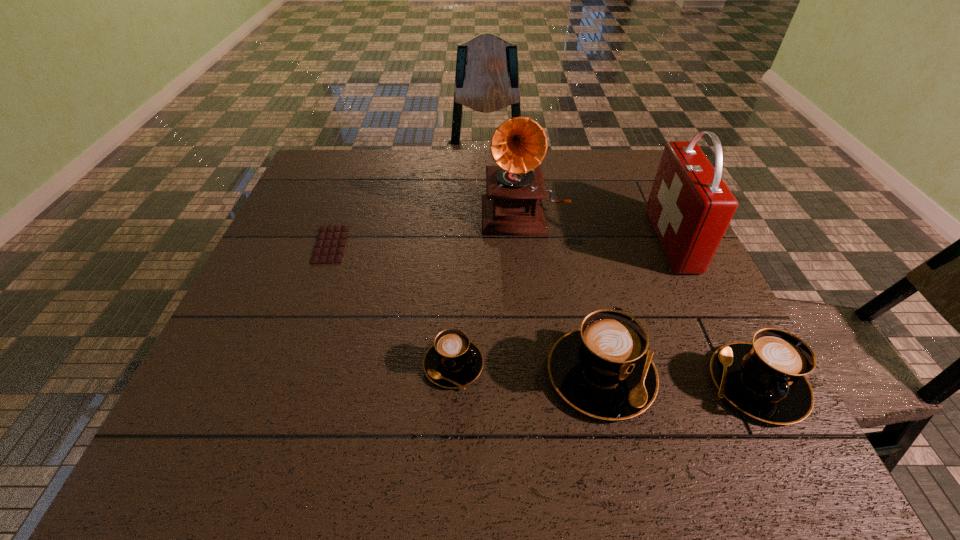
Image resolution: width=960 pixels, height=540 pixels. Find the location of `vacant area situated on the back of the second cappuccino from right to left`. vacant area situated on the back of the second cappuccino from right to left is located at coordinates (588, 310).

Find the location of a particular element. free space located 0.260m on the back of the fourth tallest object is located at coordinates (693, 259).

The height and width of the screenshot is (540, 960). Find the location of `free region located on the horn of the phonograph record`. free region located on the horn of the phonograph record is located at coordinates (540, 347).

This screenshot has width=960, height=540. Find the location of `vacant space located on the front face of the first-aid kit`. vacant space located on the front face of the first-aid kit is located at coordinates (546, 241).

Locate an element on the screen. vacant region located 0.080m on the front face of the first-aid kit is located at coordinates (625, 241).

Locate an element on the screen. The image size is (960, 540). vacant space located on the front face of the first-aid kit is located at coordinates (606, 241).

You are a GUI agent. You are given a task and a screenshot of the screen. Output one action in this format:
    pyautogui.click(x=<x>, y=<y>)
    Task: Click on the free space located 0.280m on the back of the leftmost object
    The height and width of the screenshot is (540, 960).
    Given the screenshot: What is the action you would take?
    pyautogui.click(x=358, y=169)

Identify the location of object situated at the far edge. The height and width of the screenshot is (540, 960). (512, 206).

You are a GUI agent. You are given a task and a screenshot of the screen. Output one action in this format:
    pyautogui.click(x=<x>, y=<y>)
    Task: Click on the object present at the left edge
    The width and height of the screenshot is (960, 540).
    Given the screenshot: What is the action you would take?
    [x=329, y=248]

I want to click on cappuccino that is at the right edge, so click(765, 379).